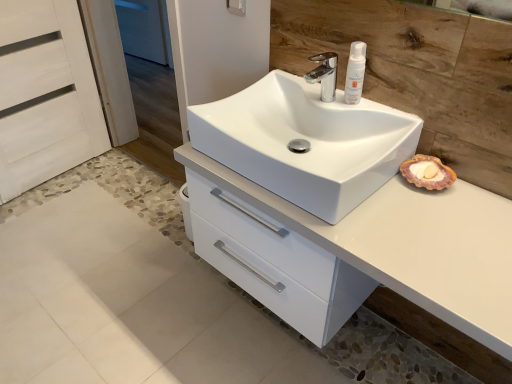
I want to click on vacant area situated below white glossy cabinet at center (from a real-world perspective), so click(x=327, y=347).